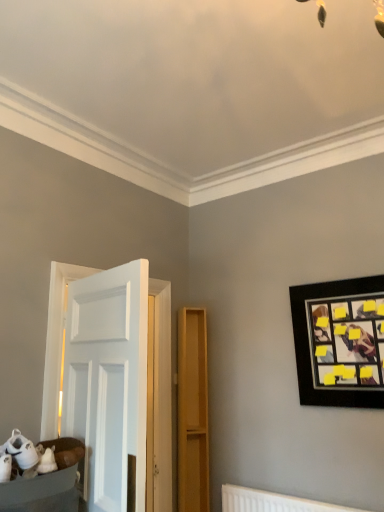
Question: Does white plastic radiator at lower center appear on the right side of matte wood dresser at center?

Choices:
 (A) yes
 (B) no

Answer: (A)

Question: Is white plastic radiator at lower center smaller than matte wood dresser at center?

Choices:
 (A) yes
 (B) no

Answer: (A)

Question: From the image's perspective, is white plastic radiator at lower center over matte wood dresser at center?

Choices:
 (A) no
 (B) yes

Answer: (A)

Question: Considering the relative positions of white plastic radiator at lower center and matte wood dresser at center in the image provided, is white plastic radiator at lower center to the left of matte wood dresser at center from the viewer's perspective?

Choices:
 (A) no
 (B) yes

Answer: (A)

Question: Is white plastic radiator at lower center outside of matte wood dresser at center?

Choices:
 (A) yes
 (B) no

Answer: (A)

Question: Is white plastic radiator at lower center positioned far away from matte wood dresser at center?

Choices:
 (A) yes
 (B) no

Answer: (B)

Question: Considering the relative sizes of matte wood dresser at center and black matte picture frame at upper right in the image provided, is matte wood dresser at center bigger than black matte picture frame at upper right?

Choices:
 (A) yes
 (B) no

Answer: (B)

Question: Can you confirm if matte wood dresser at center is positioned to the right of black matte picture frame at upper right?

Choices:
 (A) no
 (B) yes

Answer: (A)

Question: From the image's perspective, would you say matte wood dresser at center is shown under black matte picture frame at upper right?

Choices:
 (A) yes
 (B) no

Answer: (A)

Question: Is matte wood dresser at center taller than black matte picture frame at upper right?

Choices:
 (A) yes
 (B) no

Answer: (A)

Question: Is matte wood dresser at center closer to camera compared to black matte picture frame at upper right?

Choices:
 (A) no
 (B) yes

Answer: (A)

Question: From a real-world perspective, is matte wood dresser at center over black matte picture frame at upper right?

Choices:
 (A) yes
 (B) no

Answer: (B)

Question: Is black matte picture frame at upper right facing away from white plastic radiator at lower center?

Choices:
 (A) no
 (B) yes

Answer: (A)